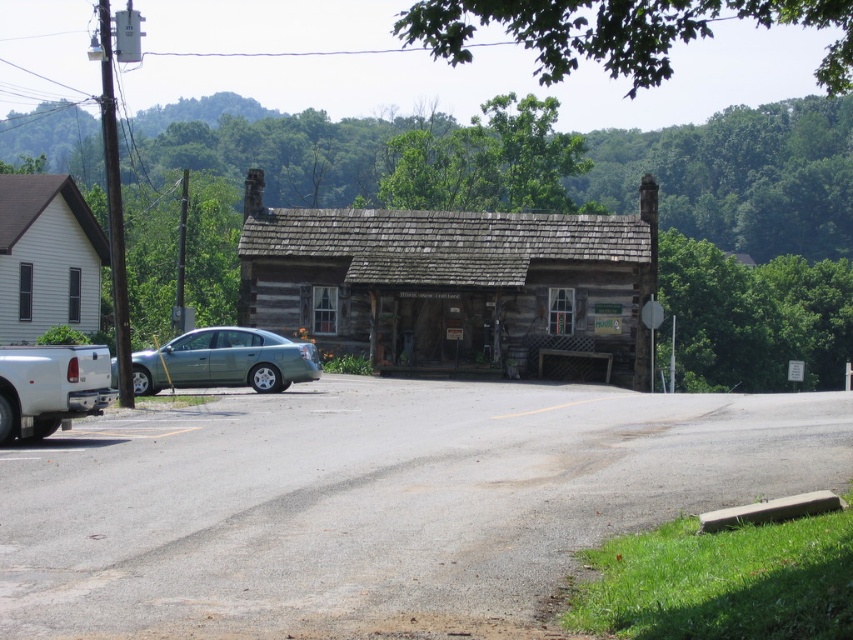
Does white wood cabin at left have a greater width compared to green matte sedan at center?

No, white wood cabin at left is not wider than green matte sedan at center.

Can you confirm if white wood cabin at left is positioned to the left of green matte sedan at center?

Correct, you'll find white wood cabin at left to the left of green matte sedan at center.

Between point (28, 266) and point (229, 328), which one is positioned in front?

Point (229, 328) is in front.

Locate an element on the screen. Image resolution: width=853 pixels, height=640 pixels. white wood cabin at left is located at coordinates (47, 257).

Consider the image. Can you confirm if weathered wood log cabin at center is bigger than green matte sedan at center?

Indeed, weathered wood log cabin at center has a larger size compared to green matte sedan at center.

From the picture: Which of these two, weathered wood log cabin at center or green matte sedan at center, stands taller?

With more height is weathered wood log cabin at center.

Between point (345, 296) and point (198, 365), which one is positioned behind?

Point (345, 296)

Find the location of a particular element. The height and width of the screenshot is (640, 853). weathered wood log cabin at center is located at coordinates (453, 284).

The width and height of the screenshot is (853, 640). Find the location of `weathered wood log cabin at center`. weathered wood log cabin at center is located at coordinates (453, 284).